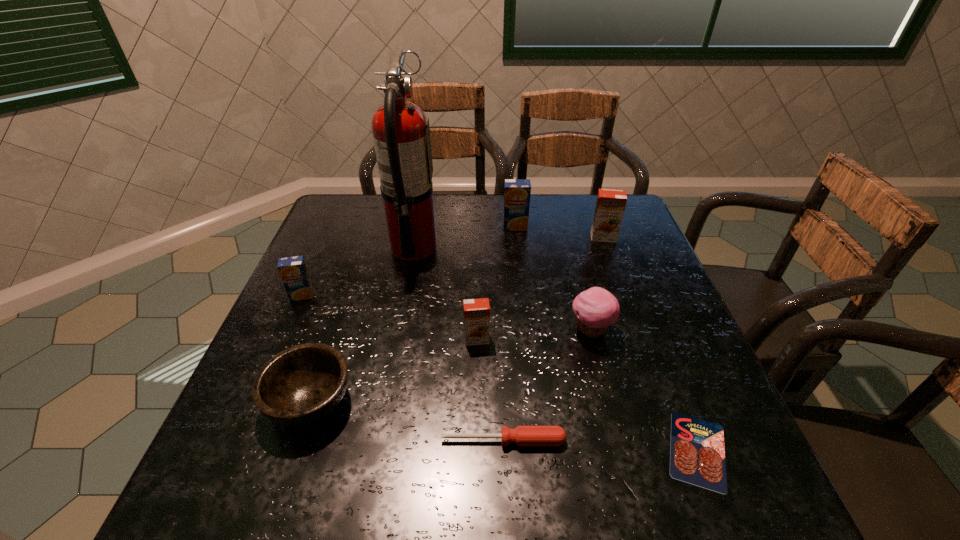
Where is `free space between the third shortest object and the left orange orange juice`? The width and height of the screenshot is (960, 540). free space between the third shortest object and the left orange orange juice is located at coordinates (394, 370).

You are a GUI agent. You are given a task and a screenshot of the screen. Output one action in this format:
    pyautogui.click(x=<x>, y=<y>)
    Task: Click on the vacant space in between the farther blue orange_juice and the brown bowl
    The image size is (960, 540).
    Given the screenshot: What is the action you would take?
    pyautogui.click(x=413, y=314)

The image size is (960, 540). Find the location of `free space between the third object from right to left and the bowl`. free space between the third object from right to left and the bowl is located at coordinates (451, 366).

Locate an element on the screen. Image resolution: width=960 pixels, height=540 pixels. empty space between the smaller orange orange juice and the red screwdriver is located at coordinates (490, 390).

I want to click on blank region between the farther orange orange juice and the shortest object, so click(651, 344).

The image size is (960, 540). In order to click on vacant space that's between the screwdriver and the bigger blue orange_juice in this screenshot , I will do `click(509, 333)`.

Locate an element on the screen. The image size is (960, 540). empty space between the nearer orange orange juice and the fire extinguisher is located at coordinates (445, 293).

Find the location of a particular element. empty location between the smaller blue orange_juice and the shortest object is located at coordinates (500, 373).

Where is `unoccupied area between the second shortest object and the tallest object`? The image size is (960, 540). unoccupied area between the second shortest object and the tallest object is located at coordinates (459, 344).

Find the location of a particular element. unoccupied position between the cupcake and the tallest object is located at coordinates pos(502,289).